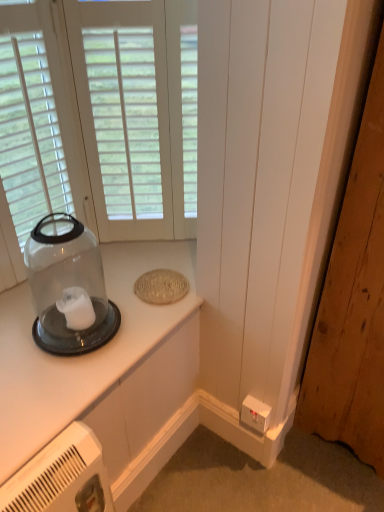
In order to click on vacant area that is in front of white wood window at upper left in this screenshot , I will do `click(129, 268)`.